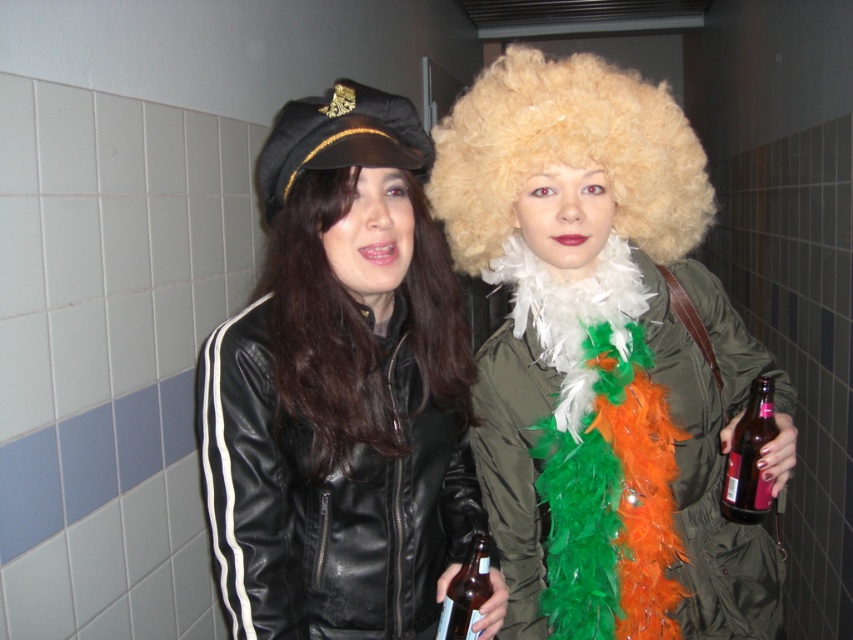
Question: Can you confirm if brown glass bottle at right is positioned to the right of brown glass bottle at center?

Choices:
 (A) yes
 (B) no

Answer: (A)

Question: Which point is farther from the camera taking this photo?

Choices:
 (A) (476, 160)
 (B) (471, 588)
 (C) (373, 506)
 (D) (541, 552)

Answer: (D)

Question: Is brown glass bottle at right wider than brown glass bottle at center?

Choices:
 (A) no
 (B) yes

Answer: (B)

Question: Which point is farther from the camera taking this photo?

Choices:
 (A) (479, 264)
 (B) (527, 573)
 (C) (633, 396)

Answer: (A)

Question: Which point is closer to the camera taking this photo?

Choices:
 (A) (724, 472)
 (B) (560, 262)

Answer: (A)

Question: Is shiny black leather jacket at center above brown glass bottle at center?

Choices:
 (A) no
 (B) yes

Answer: (B)